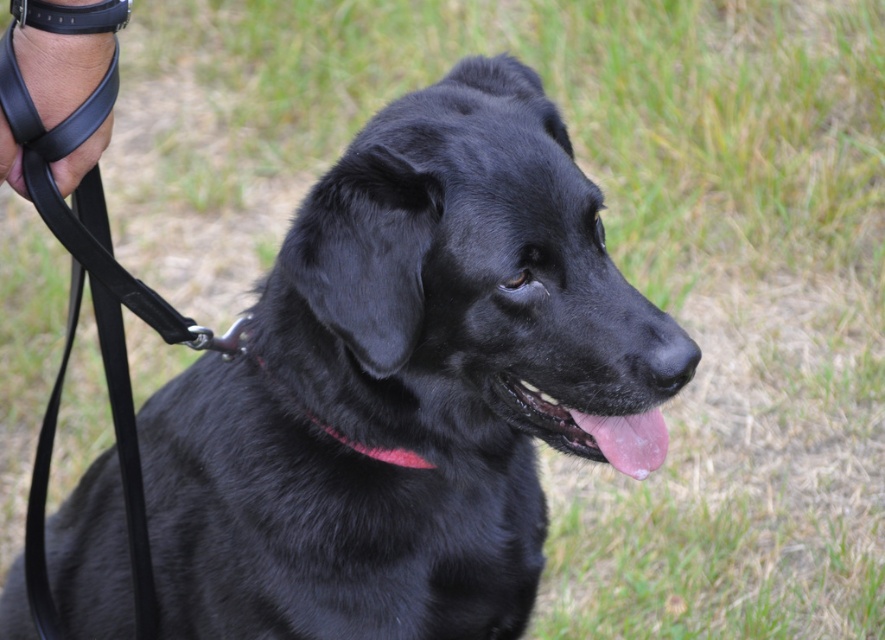
You are a dog trainer observing the scene. The black leather leash at upper left and the pink glossy tongue at center are both visible. Which object is positioned higher in the image?

The black leather leash at upper left is located above the pink glossy tongue at center, so the black leather leash at upper left is positioned higher in the image.